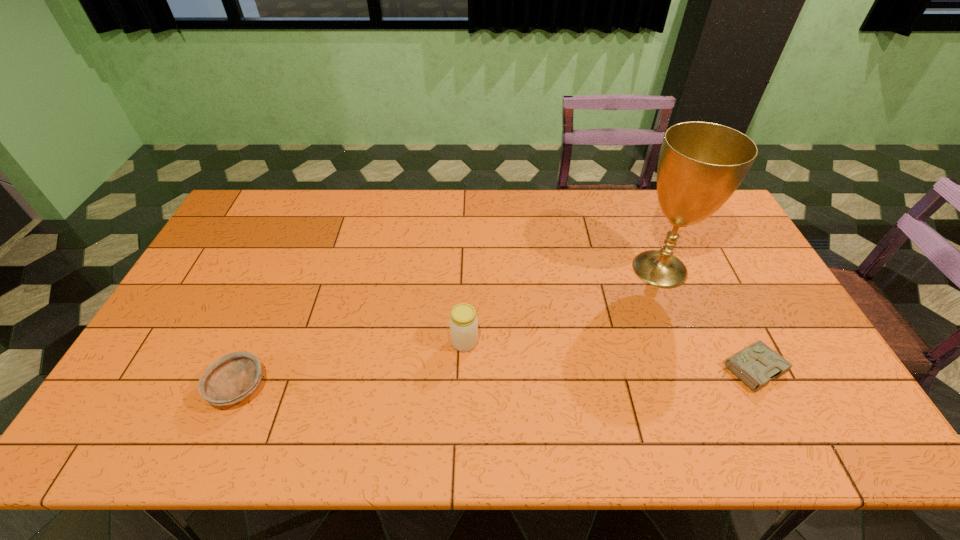
Locate an element on the screen. The width and height of the screenshot is (960, 540). object situated at the near edge is located at coordinates (232, 378).

Identify the location of object that is at the right edge. (757, 364).

The width and height of the screenshot is (960, 540). In order to click on free region at the far edge of the desktop in this screenshot , I will do `click(555, 223)`.

Locate an element on the screen. vacant space at the near edge of the desktop is located at coordinates (654, 429).

In the image, there is a desktop. Identify the location of vacant space at the left edge. (268, 237).

Find the location of a particular element. vacant space at the right edge is located at coordinates (704, 258).

Locate an element on the screen. This screenshot has height=540, width=960. free point at the near left corner is located at coordinates (110, 422).

You are a GUI agent. You are given a task and a screenshot of the screen. Output one action in this format:
    pyautogui.click(x=<x>, y=<y>)
    Task: Click on the vacant area that lies between the jar and the second shortest object
    The width and height of the screenshot is (960, 540).
    Given the screenshot: What is the action you would take?
    click(351, 365)

Locate an element on the screen. vacant space that's between the leftmost object and the farthest object is located at coordinates (449, 328).

Locate an element on the screen. free area in between the second tallest object and the second shortest object is located at coordinates (351, 365).